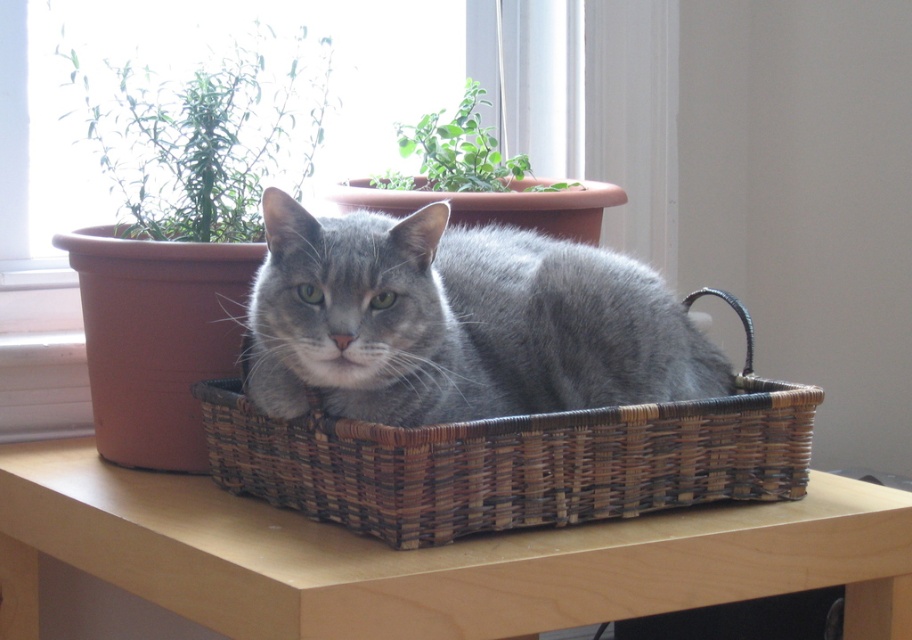
Is woven brown basket at center closer to the viewer compared to green leafy plant at upper center?

Yes, it is.

Which is above, woven brown basket at center or green leafy plant at upper center?

Positioned higher is green leafy plant at upper center.

Describe the element at coordinates (515, 458) in the screenshot. I see `woven brown basket at center` at that location.

This screenshot has width=912, height=640. What are the coordinates of `woven brown basket at center` in the screenshot? It's located at (515, 458).

Which of these two, gray matte fur cat at center or woven brown basket at center, stands taller?

woven brown basket at center is taller.

In the scene shown: Can you confirm if gray matte fur cat at center is bigger than woven brown basket at center?

Incorrect, gray matte fur cat at center is not larger than woven brown basket at center.

Does point (289, 244) come behind point (469, 512)?

No, it is not.

What are the coordinates of `gray matte fur cat at center` in the screenshot? It's located at (459, 321).

Measure the distance between wooden table at center and gray matte fur cat at center.

wooden table at center and gray matte fur cat at center are 10.80 inches apart from each other.

Looking at this image, does wooden table at center appear on the left side of gray matte fur cat at center?

Indeed, wooden table at center is positioned on the left side of gray matte fur cat at center.

Is point (309, 589) positioned in front of point (444, 253)?

That is True.

You are a GUI agent. You are given a task and a screenshot of the screen. Output one action in this format:
    pyautogui.click(x=<x>, y=<y>)
    Task: Click on the wooden table at center
    
    Given the screenshot: What is the action you would take?
    pyautogui.click(x=431, y=557)